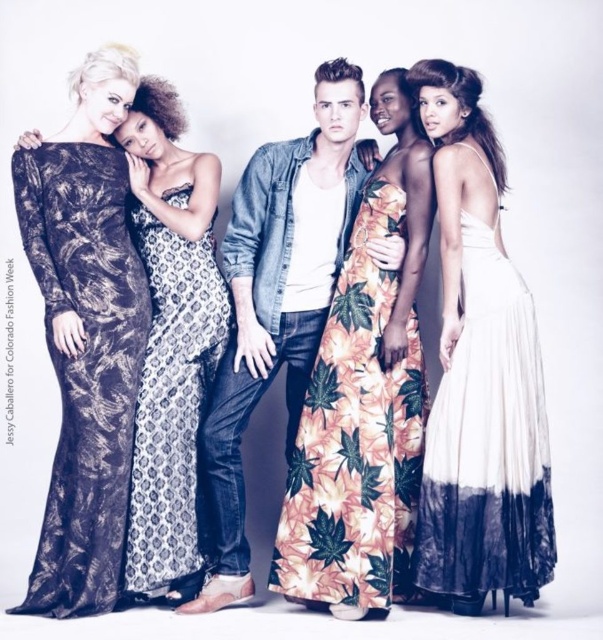
Question: Which of the following is the farthest from the observer?

Choices:
 (A) (212, 424)
 (B) (411, 456)

Answer: (B)

Question: Which of the following is the farthest from the observer?

Choices:
 (A) (472, 410)
 (B) (379, 452)
 (C) (326, 74)

Answer: (C)

Question: In this image, where is metallic lace gown at left located relative to printed silk dress at center?

Choices:
 (A) below
 (B) above

Answer: (B)

Question: Is white pleated dress at right further to the viewer compared to metallic lace gown at left?

Choices:
 (A) no
 (B) yes

Answer: (A)

Question: Is denim shirt at center to the right of printed silk dress at center from the viewer's perspective?

Choices:
 (A) no
 (B) yes

Answer: (B)

Question: Which point is closer to the camera taking this photo?

Choices:
 (A) (298, 540)
 (B) (119, 417)
 (C) (487, 461)

Answer: (C)